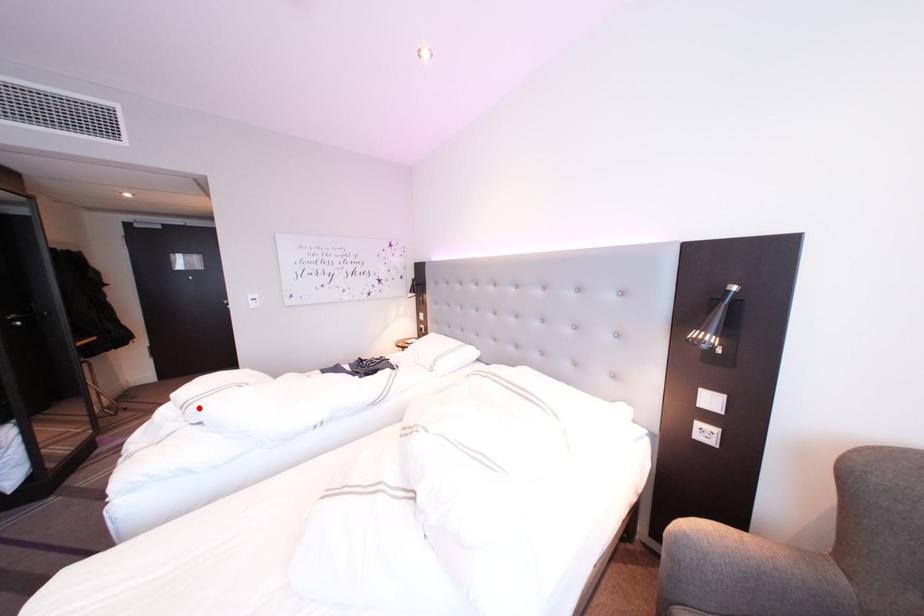
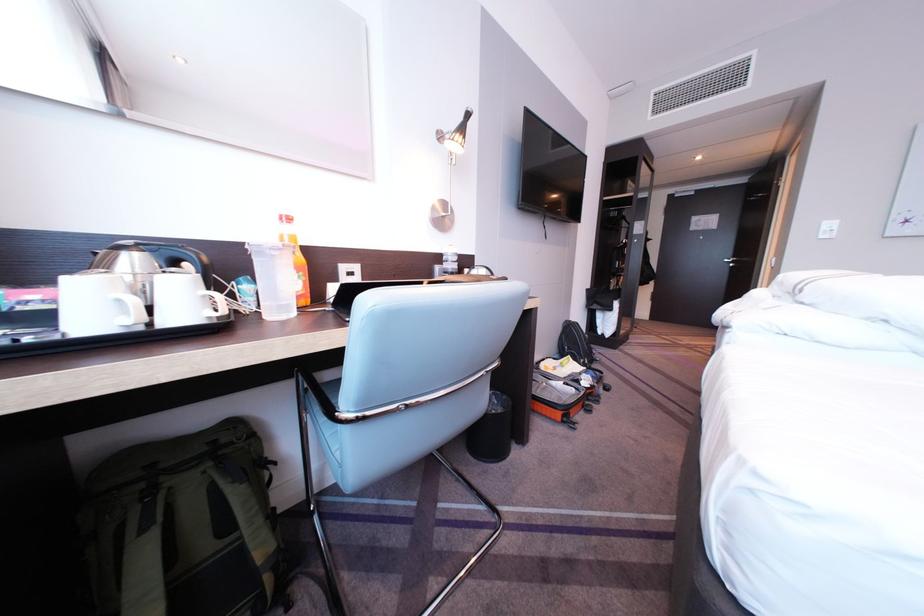
The point at the highlighted location is marked in the first image. Where is the corresponding point in the second image?

(820, 285)